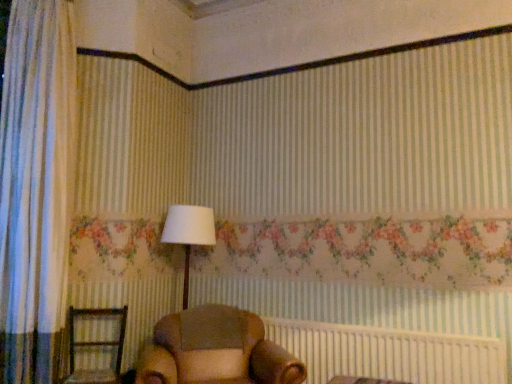
Question: Considering the relative sizes of white fabric lampshade at center and brown leather armchair at center, which is counted as the 1th furniture, starting from the right, in the image provided, is white fabric lampshade at center wider than brown leather armchair at center, which is counted as the 1th furniture, starting from the right,?

Choices:
 (A) yes
 (B) no

Answer: (B)

Question: Is white fabric lampshade at center beside brown leather armchair at center, which is counted as the 1th furniture, starting from the right?

Choices:
 (A) yes
 (B) no

Answer: (B)

Question: From the image's perspective, is white fabric lampshade at center on top of brown leather armchair at center, which ranks as the second furniture in left-to-right order?

Choices:
 (A) yes
 (B) no

Answer: (A)

Question: Is white fabric lampshade at center at the right side of brown leather armchair at center, which ranks as the second furniture in left-to-right order?

Choices:
 (A) yes
 (B) no

Answer: (B)

Question: Is white fabric lampshade at center not near brown leather armchair at center, which is counted as the 1th furniture, starting from the right?

Choices:
 (A) no
 (B) yes

Answer: (A)

Question: From the image's perspective, is brown fabric bed frame at lower center located above or below white fabric lampshade at center?

Choices:
 (A) above
 (B) below

Answer: (B)

Question: Relative to white fabric lampshade at center, is brown fabric bed frame at lower center in front or behind?

Choices:
 (A) behind
 (B) front

Answer: (B)

Question: Do you think brown fabric bed frame at lower center is within white fabric lampshade at center, or outside of it?

Choices:
 (A) inside
 (B) outside

Answer: (B)

Question: Based on their positions, is brown fabric bed frame at lower center located to the left or right of white fabric lampshade at center?

Choices:
 (A) left
 (B) right

Answer: (B)

Question: Would you say white fabric lampshade at center is inside or outside brown wooden chair at lower left, the 1th furniture positioned from the left?

Choices:
 (A) inside
 (B) outside

Answer: (B)

Question: From the image's perspective, relative to brown wooden chair at lower left, which ranks as the 2th furniture in right-to-left order, is white fabric lampshade at center above or below?

Choices:
 (A) below
 (B) above

Answer: (B)

Question: Looking at their shapes, would you say white fabric lampshade at center is wider or thinner than brown wooden chair at lower left, the 1th furniture positioned from the left?

Choices:
 (A) wide
 (B) thin

Answer: (B)

Question: From a real-world perspective, is white fabric lampshade at center physically located above or below brown wooden chair at lower left, which ranks as the 2th furniture in right-to-left order?

Choices:
 (A) below
 (B) above

Answer: (B)

Question: Looking at their shapes, would you say brown fabric bed frame at lower center is wider or thinner than brown leather armchair at center, which ranks as the second furniture in left-to-right order?

Choices:
 (A) thin
 (B) wide

Answer: (A)

Question: Is brown fabric bed frame at lower center inside the boundaries of brown leather armchair at center, which ranks as the second furniture in left-to-right order, or outside?

Choices:
 (A) inside
 (B) outside

Answer: (B)